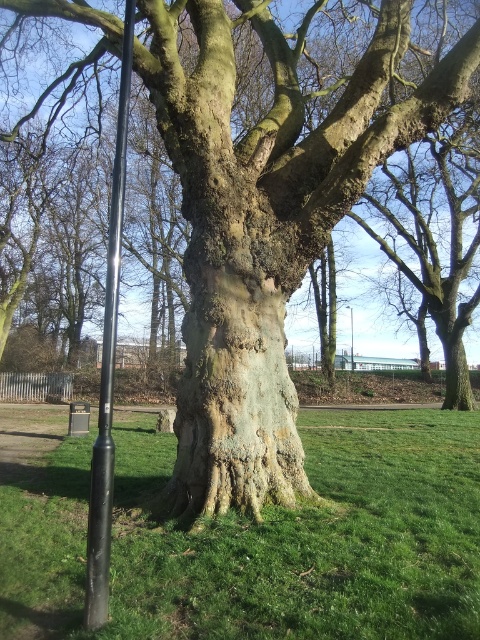
Find the location of `green grassy at center`. green grassy at center is located at coordinates (262, 541).

Can you confirm if green grassy at center is wider than black matte pole at left?

Indeed, green grassy at center has a greater width compared to black matte pole at left.

Is point (283, 602) farther from camera compared to point (100, 376)?

No, (283, 602) is in front of (100, 376).

At what (x,y) coordinates should I click in order to perform the action: click on green grassy at center. Please return your answer as a coordinate pair (x, y). Image resolution: width=480 pixels, height=640 pixels. Looking at the image, I should click on (262, 541).

This screenshot has width=480, height=640. I want to click on green grassy at center, so click(x=262, y=541).

Can you confirm if green grassy at center is smaller than black metal pole at center?

Incorrect, green grassy at center is not smaller in size than black metal pole at center.

Is point (424, 456) positioned after point (349, 316)?

No, it is in front of (349, 316).

Locate an element on the screen. green grassy at center is located at coordinates (262, 541).

Is black matte pole at left positioned at the back of black metal pole at center?

No, black matte pole at left is in front of black metal pole at center.

Is point (123, 90) farther from viewer compared to point (351, 365)?

No, (123, 90) is in front of (351, 365).

Between point (108, 362) and point (349, 312), which one is positioned behind?

The point (349, 312) is more distant.

Where is `black matte pole at left`? The image size is (480, 640). black matte pole at left is located at coordinates (108, 368).